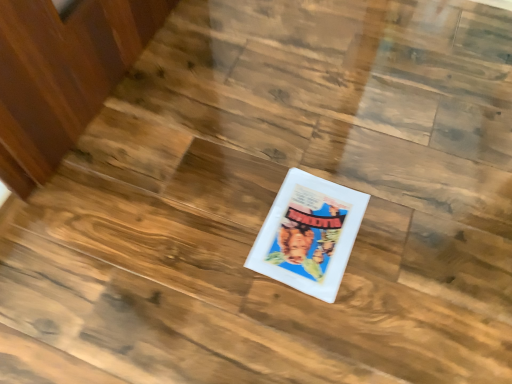
The width and height of the screenshot is (512, 384). I want to click on unoccupied region to the right of white glossy book at center, so click(404, 233).